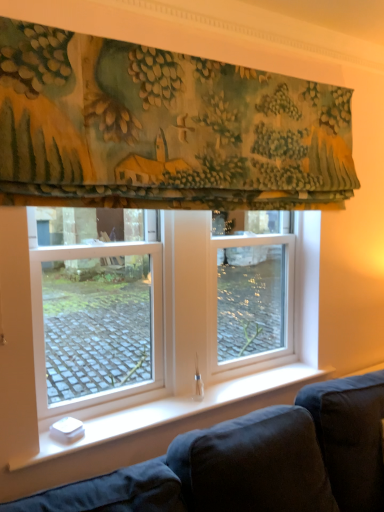
Question: From a real-world perspective, is textured green fabric at upper center physically located above or below dark blue fabric couch at lower left?

Choices:
 (A) above
 (B) below

Answer: (A)

Question: Is textured green fabric at upper center wider or thinner than dark blue fabric couch at lower left?

Choices:
 (A) wide
 (B) thin

Answer: (A)

Question: Which object is the farthest from the dark blue fabric couch at lower left?

Choices:
 (A) textured green fabric at upper center
 (B) clear glass window at center

Answer: (A)

Question: Which object is the closest to the clear glass window at center?

Choices:
 (A) textured green fabric at upper center
 (B) dark blue fabric couch at lower left

Answer: (A)